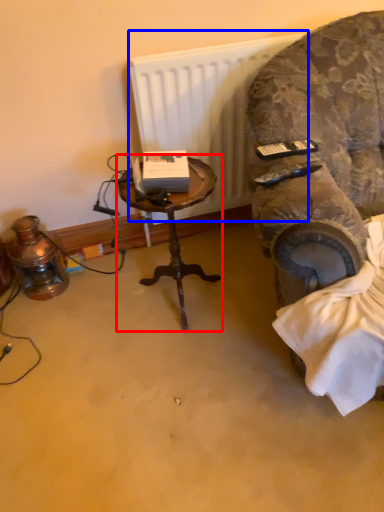
Question: Which point is closer to the camera, table (highlighted by a red box) or radiator (highlighted by a blue box)?

Choices:
 (A) table
 (B) radiator

Answer: (A)